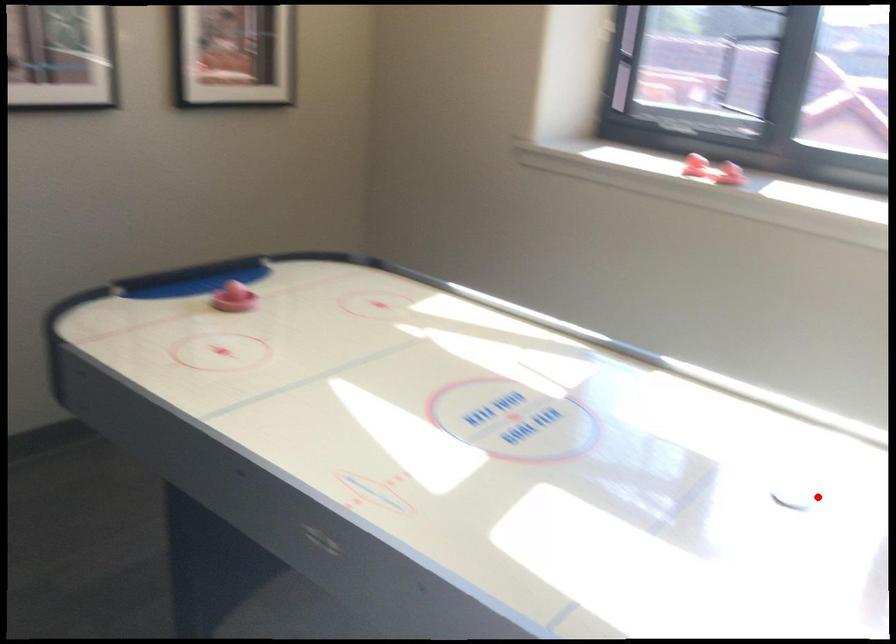
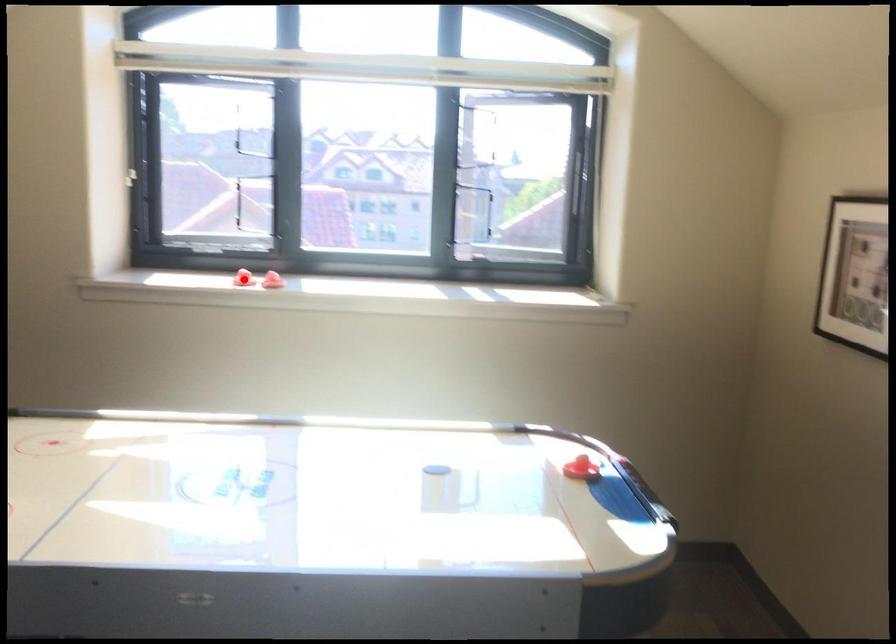
I am providing you with two images of the same scene from different viewpoints. A red point is marked on the first image and another point is marked on the second image. Do the highlighted points in image1 and image2 indicate the same real-world spot?

No